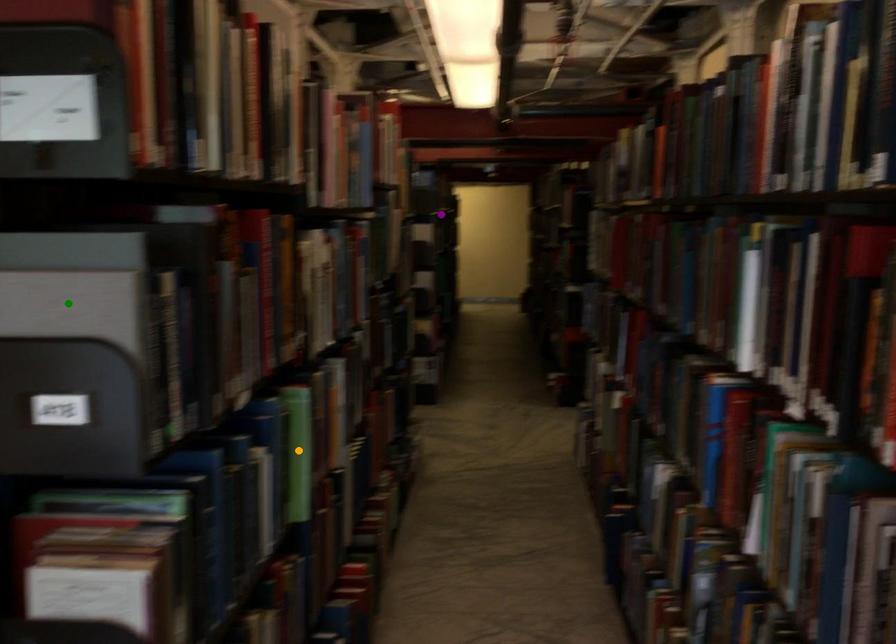
Order these from nearest to farthest:
- purple point
- green point
- orange point

green point, orange point, purple point